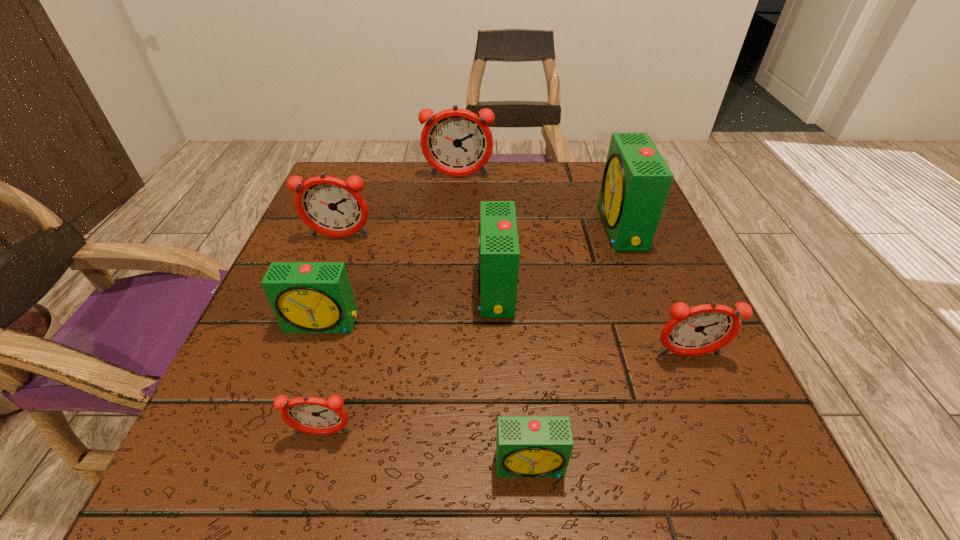
Where is `free space located 0.150m on the front-facing side of the third smallest green alarm clock`? free space located 0.150m on the front-facing side of the third smallest green alarm clock is located at coordinates (396, 290).

At what (x,y) coordinates should I click in order to perform the action: click on vacant space situated on the front-facing side of the sixth farthest object. Please return your answer as a coordinate pair (x, y). Looking at the image, I should click on (741, 478).

The height and width of the screenshot is (540, 960). In order to click on free space located on the front-facing side of the leftmost green alarm clock in this screenshot , I will do `click(308, 364)`.

I want to click on object that is at the near left corner, so click(312, 415).

What are the coordinates of `object present at the far right corner` in the screenshot? It's located at (636, 181).

This screenshot has width=960, height=540. Identify the location of blank area at the far edge. (516, 171).

In the image, there is a desktop. Where is `vacant space at the near edge`? vacant space at the near edge is located at coordinates (613, 492).

You are a GUI agent. You are given a task and a screenshot of the screen. Output one action in this format:
    pyautogui.click(x=<x>, y=<y>)
    Task: Click on the vacant region at the left edge of the desktop
    The height and width of the screenshot is (540, 960).
    Given the screenshot: What is the action you would take?
    pyautogui.click(x=302, y=253)

The image size is (960, 540). Identify the location of vacant space at the right edge. (682, 274).

What are the coordinates of `vacant space at the far left corner of the desktop` in the screenshot? It's located at (392, 171).